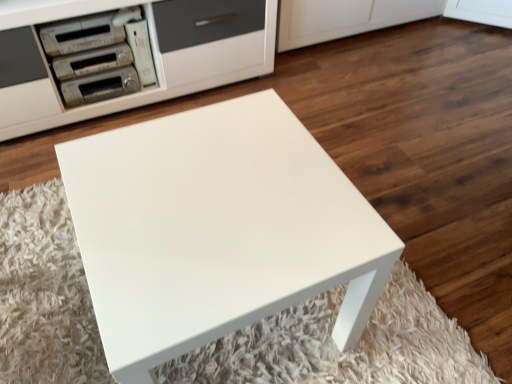
Question: From the image's perspective, is metallic silver appliance at upper left, which is the fourth appliance in front-to-back order, positioned above or below matte silver stereo at upper left, acting as the third appliance starting from the back?

Choices:
 (A) below
 (B) above

Answer: (A)

Question: From a real-world perspective, is metallic silver appliance at upper left, which is the fourth appliance in front-to-back order, physically located above or below matte silver stereo at upper left, marked as the 2th appliance in a front-to-back arrangement?

Choices:
 (A) above
 (B) below

Answer: (B)

Question: Estimate the real-world distances between objects in this image. Which object is farther from the white plastic game console at upper left, the third appliance positioned from the front?

Choices:
 (A) matte silver stereo at upper left, acting as the third appliance starting from the back
 (B) metallic silver stereo at upper left, which appears as the first appliance when viewed from the front
 (C) metallic silver appliance at upper left, the 1th appliance positioned from the back
 (D) white glossy table at center

Answer: (D)

Question: Which is nearer to the metallic silver stereo at upper left, the fourth appliance viewed from the back?

Choices:
 (A) white glossy table at center
 (B) metallic silver appliance at upper left, which is the fourth appliance in front-to-back order
 (C) matte silver stereo at upper left, marked as the 2th appliance in a front-to-back arrangement
 (D) white plastic game console at upper left, which is the 2th appliance from back to front

Answer: (C)